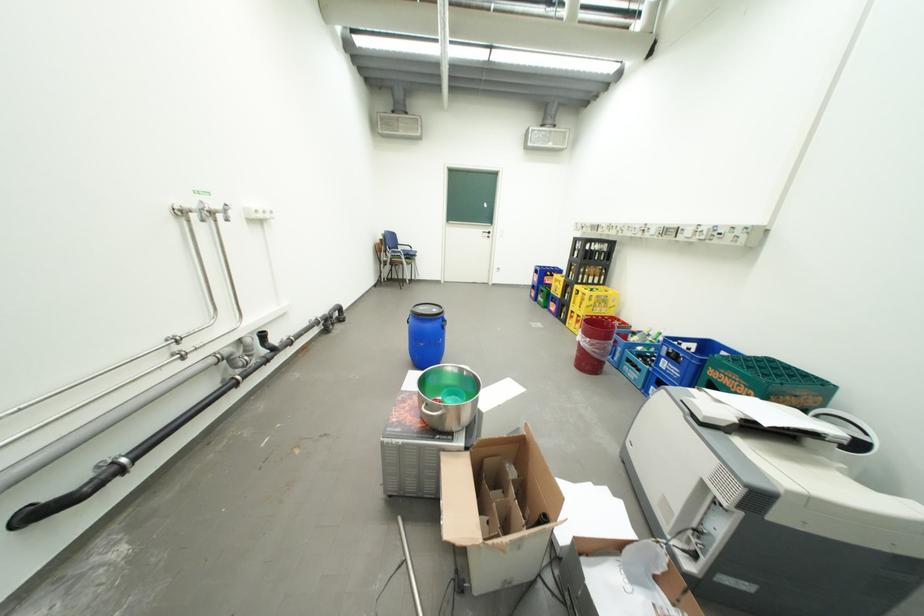
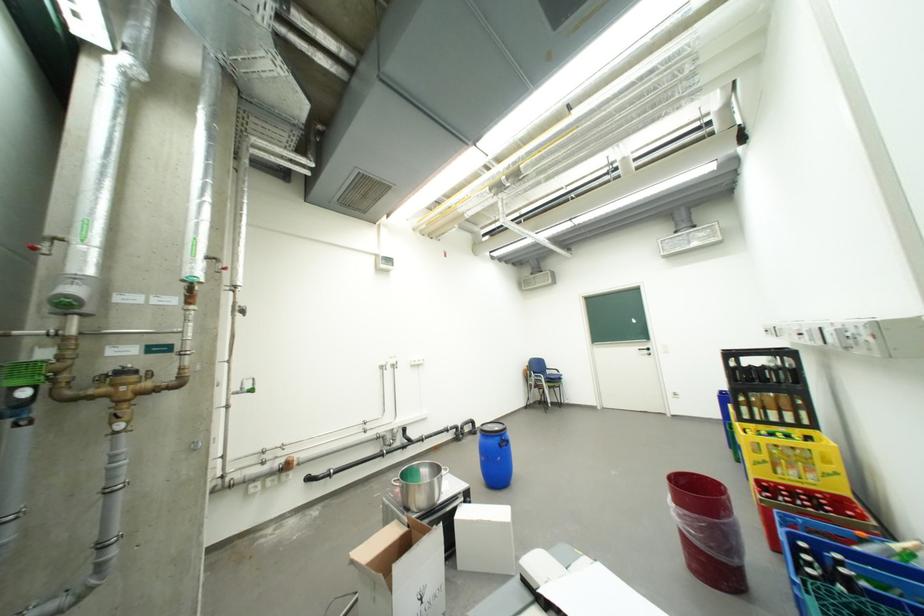
Locate, in the second image, the point that corresponds to point (450, 320) in the first image.

(507, 438)